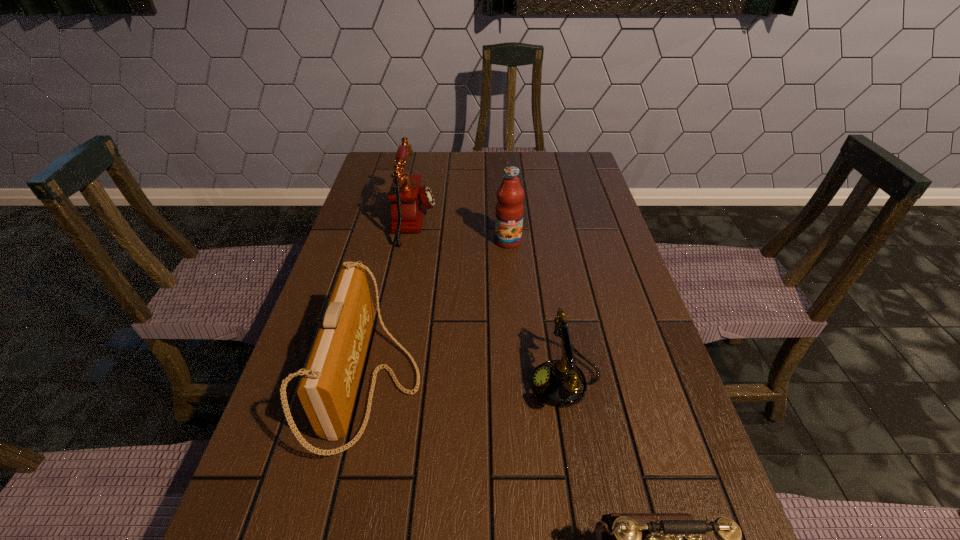
The width and height of the screenshot is (960, 540). In order to click on free space located on the dial of the second nearest telephone in this screenshot , I will do `click(348, 382)`.

Where is `telephone situated at the left edge`? telephone situated at the left edge is located at coordinates (408, 199).

You are a GUI agent. You are given a task and a screenshot of the screen. Output one action in this format:
    pyautogui.click(x=<x>, y=<y>)
    Task: Click on the handbag located in the left edge section of the desktop
    The width and height of the screenshot is (960, 540).
    Given the screenshot: What is the action you would take?
    pyautogui.click(x=327, y=389)

Where is `object that is at the right edge`? object that is at the right edge is located at coordinates (560, 383).

In the image, there is a desktop. At what (x,y) coordinates should I click in order to perform the action: click on free region at the far edge. Please return your answer as a coordinate pair (x, y). The width and height of the screenshot is (960, 540). Looking at the image, I should click on (455, 164).

At what (x,y) coordinates should I click in order to perform the action: click on blank space at the left edge of the desktop. Please return your answer as a coordinate pair (x, y). The image size is (960, 540). Looking at the image, I should click on (321, 516).

Find the location of a particular element. The image size is (960, 540). vacant space at the right edge is located at coordinates (612, 264).

The height and width of the screenshot is (540, 960). What are the coordinates of `vacant region at the far left corner of the desktop` in the screenshot? It's located at (391, 163).

The width and height of the screenshot is (960, 540). In order to click on free region at the far right corner of the desktop in this screenshot , I will do `click(593, 176)`.

The height and width of the screenshot is (540, 960). Find the location of `free space between the second nearest telephone and the tallest telephone`. free space between the second nearest telephone and the tallest telephone is located at coordinates (490, 302).